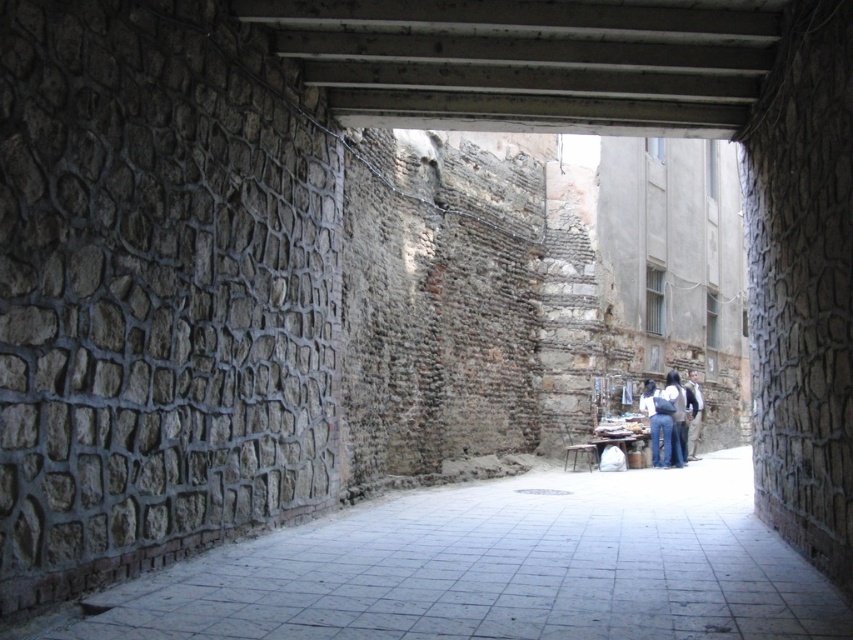
Question: Where is gray stone alley at center located in relation to light brown leather jacket at lower right in the image?

Choices:
 (A) left
 (B) right

Answer: (A)

Question: Which point is closer to the camera?

Choices:
 (A) light brown leather jacket at lower right
 (B) gray stone alley at center
 (C) dark blue jeans at center
 (D) blue jeans at center

Answer: (B)

Question: Which of the following is the farthest from the observer?

Choices:
 (A) (489, 502)
 (B) (671, 419)
 (C) (677, 461)
 (D) (691, 429)

Answer: (D)

Question: Is blue jeans at center positioned in front of dark blue jeans at center?

Choices:
 (A) yes
 (B) no

Answer: (A)

Question: Does gray stone alley at center have a smaller size compared to light brown leather jacket at lower right?

Choices:
 (A) no
 (B) yes

Answer: (A)

Question: Which object appears farthest from the camera in this image?

Choices:
 (A) gray stone alley at center
 (B) dark blue jeans at center
 (C) blue jeans at center

Answer: (B)